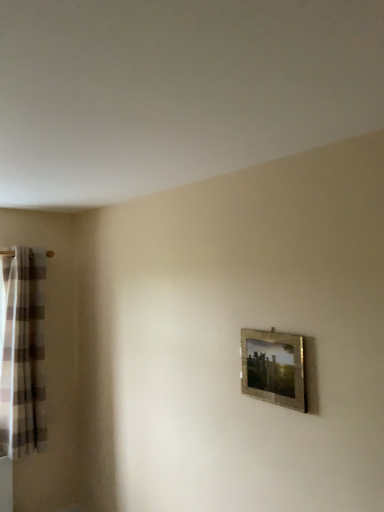
Question: Would you say gold textured frame at center right is part of plaid fabric curtain at left's contents?

Choices:
 (A) no
 (B) yes

Answer: (A)

Question: From the image's perspective, would you say plaid fabric curtain at left is positioned over gold textured frame at center right?

Choices:
 (A) yes
 (B) no

Answer: (B)

Question: Considering the relative sizes of plaid fabric curtain at left and gold textured frame at center right in the image provided, is plaid fabric curtain at left smaller than gold textured frame at center right?

Choices:
 (A) yes
 (B) no

Answer: (B)

Question: From a real-world perspective, is plaid fabric curtain at left positioned over gold textured frame at center right based on gravity?

Choices:
 (A) no
 (B) yes

Answer: (A)

Question: Is plaid fabric curtain at left wider than gold textured frame at center right?

Choices:
 (A) yes
 (B) no

Answer: (A)

Question: Does plaid fabric curtain at left appear on the left side of gold textured frame at center right?

Choices:
 (A) yes
 (B) no

Answer: (A)

Question: Is gold textured frame at center right bigger than plaid fabric curtain at left?

Choices:
 (A) no
 (B) yes

Answer: (A)

Question: Is gold textured frame at center right further to the viewer compared to plaid fabric curtain at left?

Choices:
 (A) no
 (B) yes

Answer: (A)

Question: Does gold textured frame at center right have a lesser height compared to plaid fabric curtain at left?

Choices:
 (A) yes
 (B) no

Answer: (A)

Question: Is gold textured frame at center right completely or partially outside of plaid fabric curtain at left?

Choices:
 (A) yes
 (B) no

Answer: (A)

Question: Is gold textured frame at center right surrounding plaid fabric curtain at left?

Choices:
 (A) yes
 (B) no

Answer: (B)

Question: Could you tell me if gold textured frame at center right is turned towards plaid fabric curtain at left?

Choices:
 (A) yes
 (B) no

Answer: (B)

Question: From the image's perspective, is gold textured frame at center right located above or below plaid fabric curtain at left?

Choices:
 (A) above
 (B) below

Answer: (A)